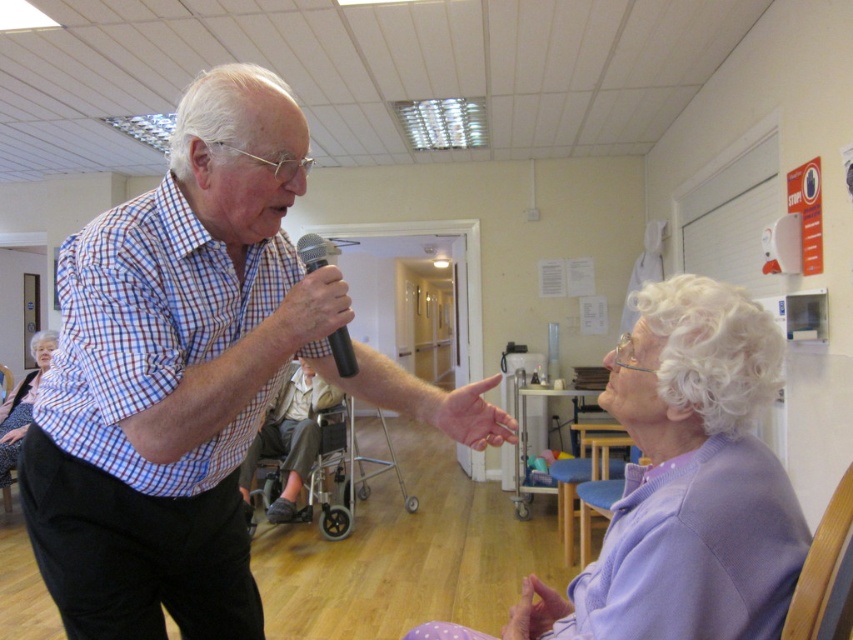
You are attending a community event and want to approach the blue checkered shirt at upper left and the metallic gray wheelchair at center. Which object should you move towards first to reach the one closer to you?

You should move towards the blue checkered shirt at upper left first because it is closer to you than the metallic gray wheelchair at center.

What are the coordinates of the blue checkered shirt at upper left?

The blue checkered shirt at upper left is located at coordinates point (190, 374).

You are an event planner organizing a seated performance for seniors. You need to ensure that the seating arrangement allows easy access for performers to interact with the audience. Given the bamboo chair at lower right and the light purple sweater at lower right, which object is positioned higher in the scene?

The bamboo chair at lower right is located above the light purple sweater at lower right, so the bamboo chair at lower right is positioned higher in the scene.